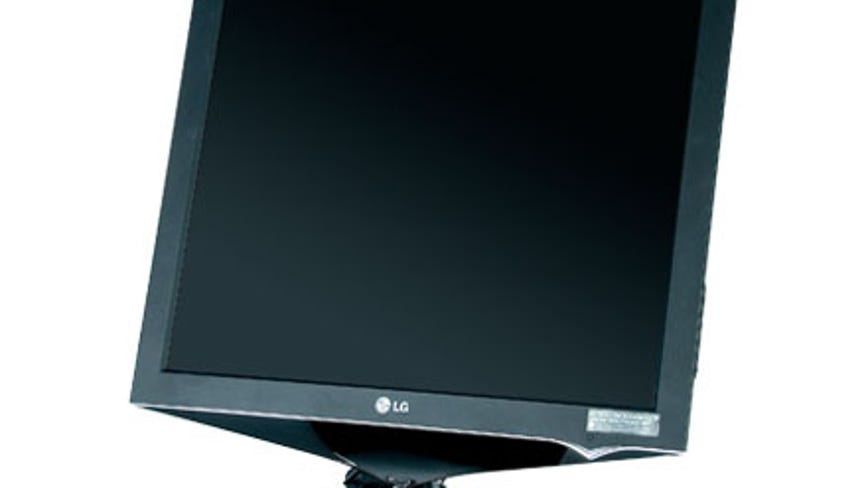
At what (x,y) coordinates should I click in order to perform the action: click on screen. Please return your answer as a coordinate pair (x, y). The height and width of the screenshot is (488, 868). Looking at the image, I should click on (418, 268).